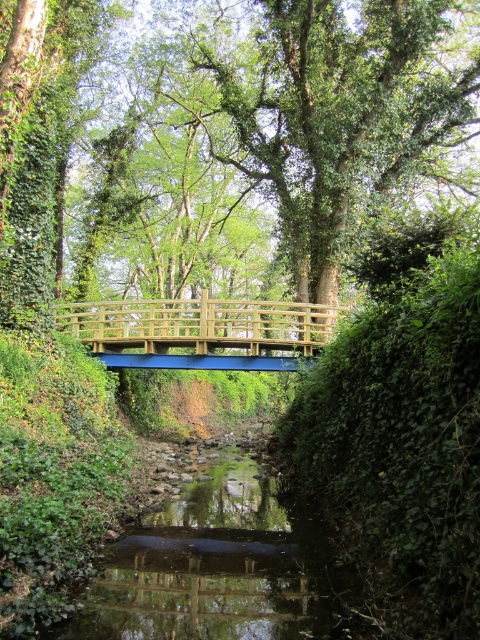
You are standing on the wooden bridge and notice a point marked at coordinates (222, 156). What object does this point correspond to?

The point at coordinates (222, 156) corresponds to the green leafy tree at center.

You are standing on the wooden bridge at center and looking towards the green leafy tree at center. Which direction should you walk to reach the tree?

The green leafy tree at center is above the wooden bridge at center, so you can walk forward towards the tree since it is positioned above the bridge.

You are a hiker standing on the wooden bridge at center. You want to take a photo of the green leafy tree at center without any obstructions. Since the bridge is in your way, can you move to the side of the bridge to capture the tree fully? Explain your reasoning.

The green leafy tree at center is wider than the wooden bridge at center. Since the tree is wider, moving to the side of the bridge would allow you to capture the entire tree without obstruction as the bridge is narrower than the tree.